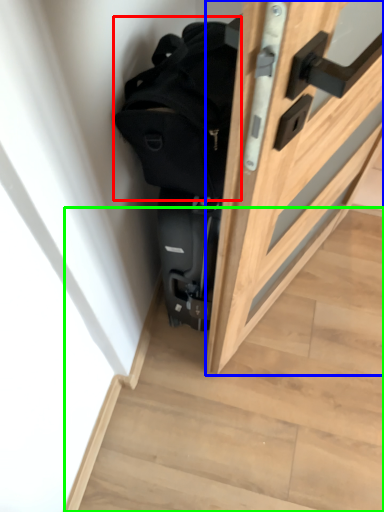
Question: Based on their relative distances, which object is farther from backpack (highlighted by a red box)? Choose from door (highlighted by a blue box) and stairwell (highlighted by a green box).

Choices:
 (A) door
 (B) stairwell

Answer: (B)